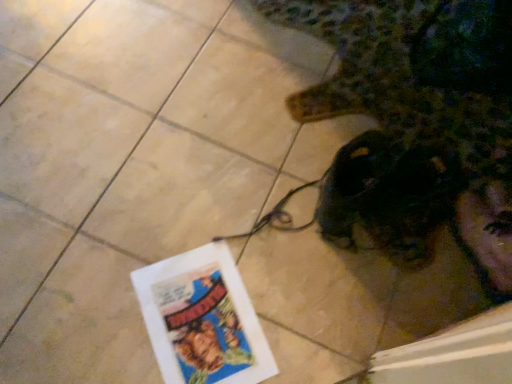
I want to click on free space above white paper flyer at lower left (from a real-world perspective), so click(x=201, y=324).